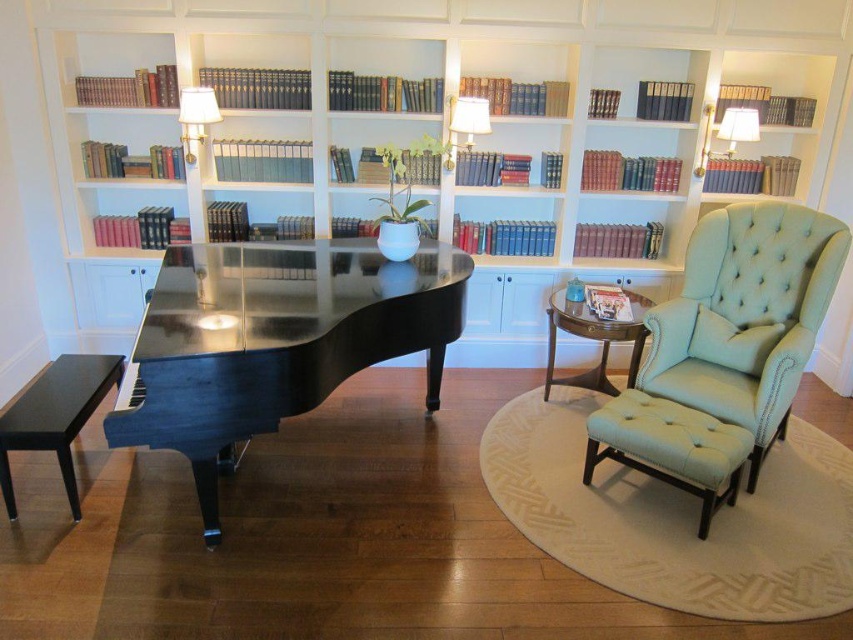
Question: Among these objects, which one is farthest from the camera?

Choices:
 (A) glossy black piano at center
 (B) white wood bookcase at center
 (C) light green leather swivel chair at right

Answer: (B)

Question: Does tufted fabric stool at right come behind mahogany wood side table at center?

Choices:
 (A) yes
 (B) no

Answer: (B)

Question: In this image, where is tufted fabric stool at right located relative to mahogany wood side table at center?

Choices:
 (A) above
 (B) below

Answer: (B)

Question: Among these objects, which one is farthest from the camera?

Choices:
 (A) white wood bookcase at center
 (B) glossy black piano at center
 (C) tufted fabric stool at right
 (D) black polished wood stool at lower left

Answer: (A)

Question: Can you confirm if tufted fabric stool at right is wider than black polished wood stool at lower left?

Choices:
 (A) no
 (B) yes

Answer: (B)

Question: Based on their relative distances, which object is farther from the mahogany wood side table at center?

Choices:
 (A) light green leather swivel chair at right
 (B) tufted fabric stool at right

Answer: (B)